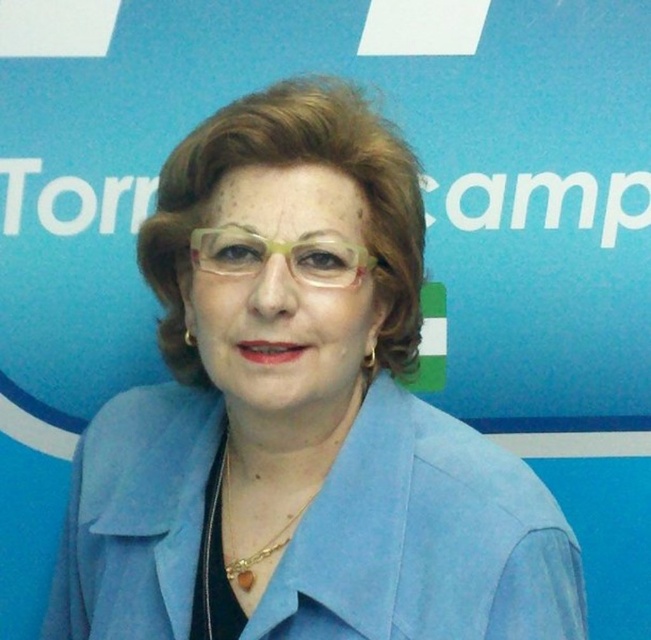
Describe the element at coordinates (299, 422) in the screenshot. I see `blue suede jacket at center` at that location.

Is point (561, 582) farther from viewer compared to point (253, 260)?

Yes, point (561, 582) is behind point (253, 260).

Who is more distant from viewer, [508,608] or [333,262]?

Point [333,262]

You are a GUI agent. You are given a task and a screenshot of the screen. Output one action in this format:
    pyautogui.click(x=<x>, y=<y>)
    Task: Click on the blue suede jacket at center
    The height and width of the screenshot is (640, 651).
    Given the screenshot: What is the action you would take?
    [299, 422]